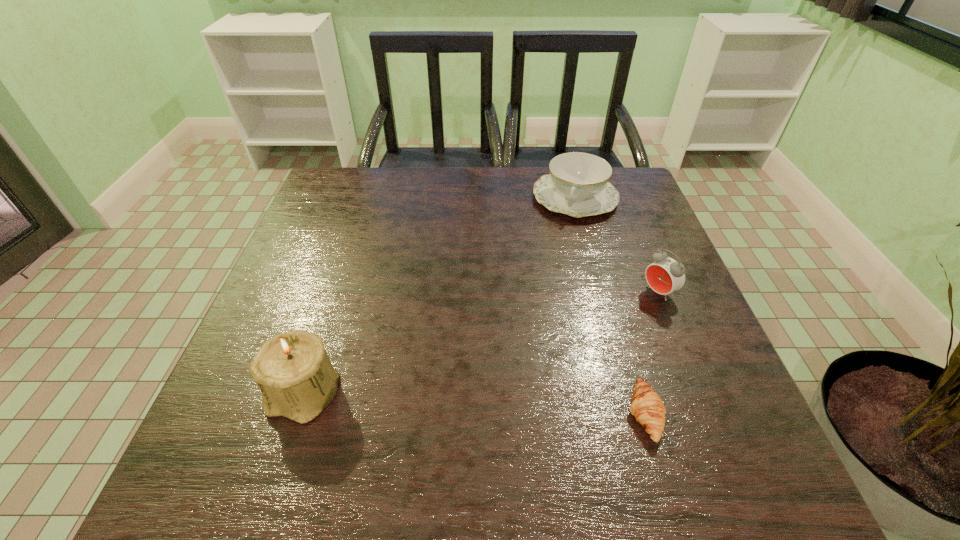
You are a GUI agent. You are given a task and a screenshot of the screen. Output one action in this format:
    pyautogui.click(x=<x>, y=<y>)
    Task: Click on the object that is at the left edge
    This screenshot has width=960, height=540.
    Given the screenshot: What is the action you would take?
    pyautogui.click(x=292, y=369)

Locate an element on the screen. The height and width of the screenshot is (540, 960). pastry that is at the right edge is located at coordinates (646, 405).

The height and width of the screenshot is (540, 960). I want to click on alarm clock located in the right edge section of the desktop, so click(x=666, y=275).

Image resolution: width=960 pixels, height=540 pixels. I want to click on chinaware situated at the right edge, so [578, 185].

Where is `object situated at the near left corner`? The width and height of the screenshot is (960, 540). object situated at the near left corner is located at coordinates (292, 369).

The width and height of the screenshot is (960, 540). I want to click on object that is at the far right corner, so click(x=578, y=185).

Locate an element on the screen. object located at the near right corner is located at coordinates (646, 405).

Identify the location of free space at the far edge. (423, 171).

Where is `free space at the left edge of the desktop`? The height and width of the screenshot is (540, 960). free space at the left edge of the desktop is located at coordinates (319, 303).

Image resolution: width=960 pixels, height=540 pixels. Find the location of `free spot at the right edge of the desktop`. free spot at the right edge of the desktop is located at coordinates (604, 228).